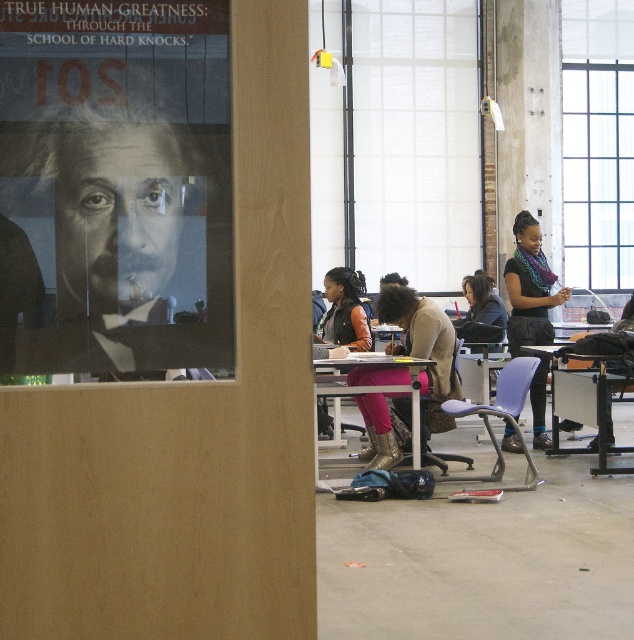
Question: Among these objects, which one is nearest to the camera?

Choices:
 (A) matte pink pants at center
 (B) metallic silver table at center
 (C) multicolored scarf at center
 (D) wooden poster at upper left

Answer: (D)

Question: Is matte pink pants at center behind multicolored scarf at center?

Choices:
 (A) yes
 (B) no

Answer: (B)

Question: Which of the following is the closest to the observer?

Choices:
 (A) (313, 396)
 (B) (611, 378)
 (C) (427, 403)
 (D) (491, 477)

Answer: (A)

Question: Is matte black poster at upper left smaller than purple plastic chair at center?

Choices:
 (A) no
 (B) yes

Answer: (B)

Question: Can you confirm if metallic silver table at center is positioned above purple plastic chair at center?

Choices:
 (A) no
 (B) yes

Answer: (B)

Question: Considering the real-world distances, which object is farthest from the multicolored scarf at center?

Choices:
 (A) metallic silver table at lower right
 (B) metallic silver table at center
 (C) purple plastic chair at center

Answer: (B)